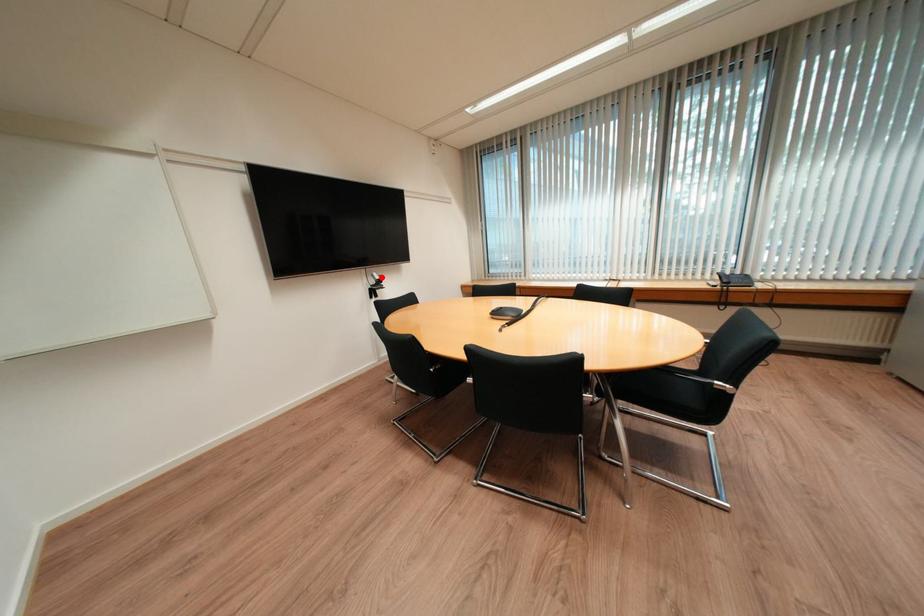
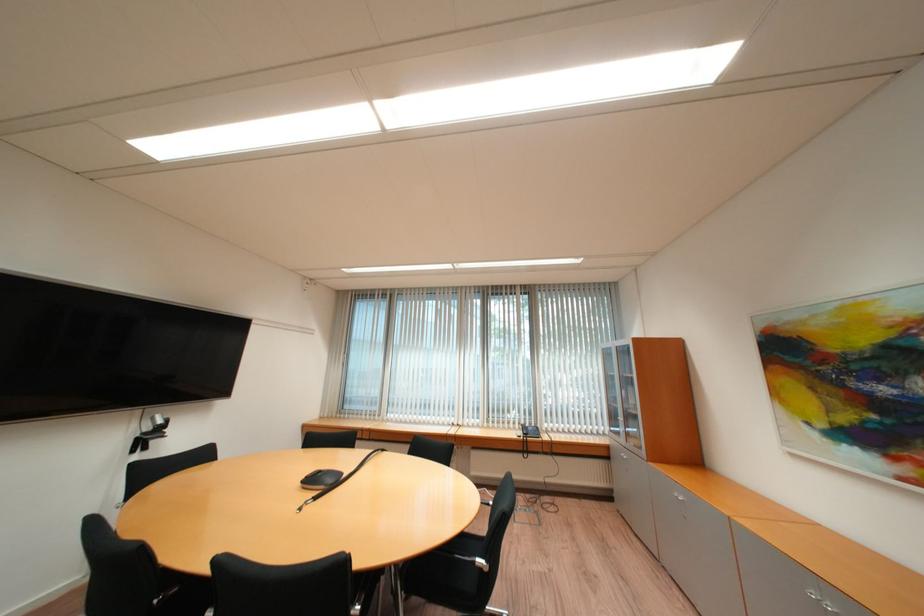
Where in the second image is the point corresponding to the highlighted location from the first image?

(162, 419)